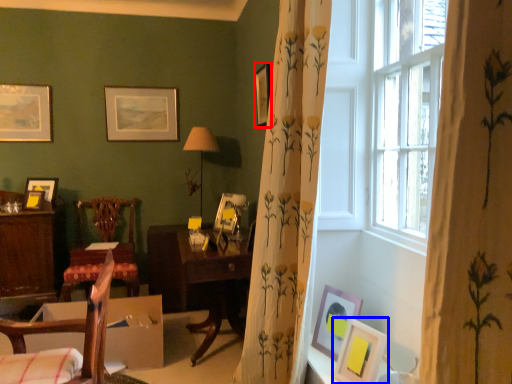
Question: Among these objects, which one is nearest to the camera, picture frame (highlighted by a red box) or picture frame (highlighted by a blue box)?

Choices:
 (A) picture frame
 (B) picture frame

Answer: (B)